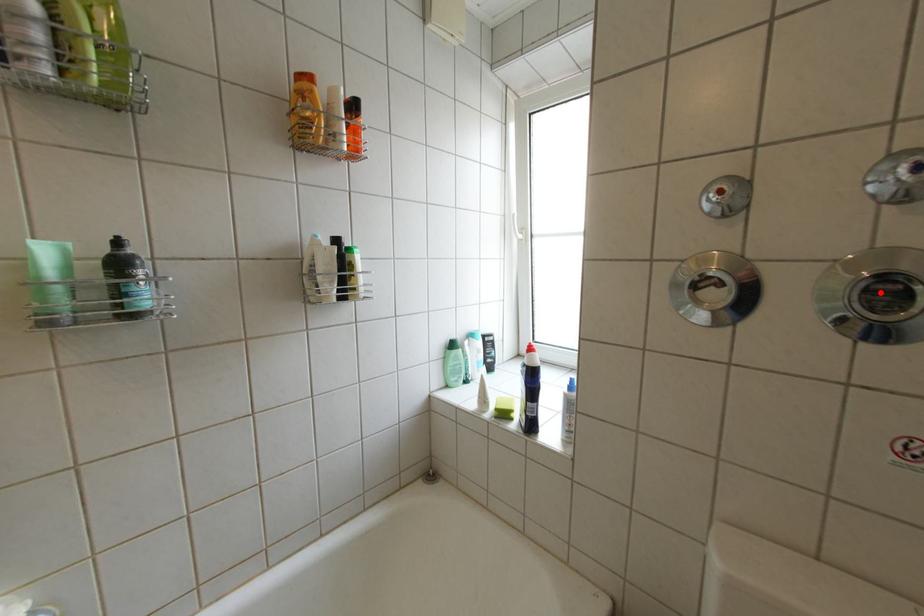
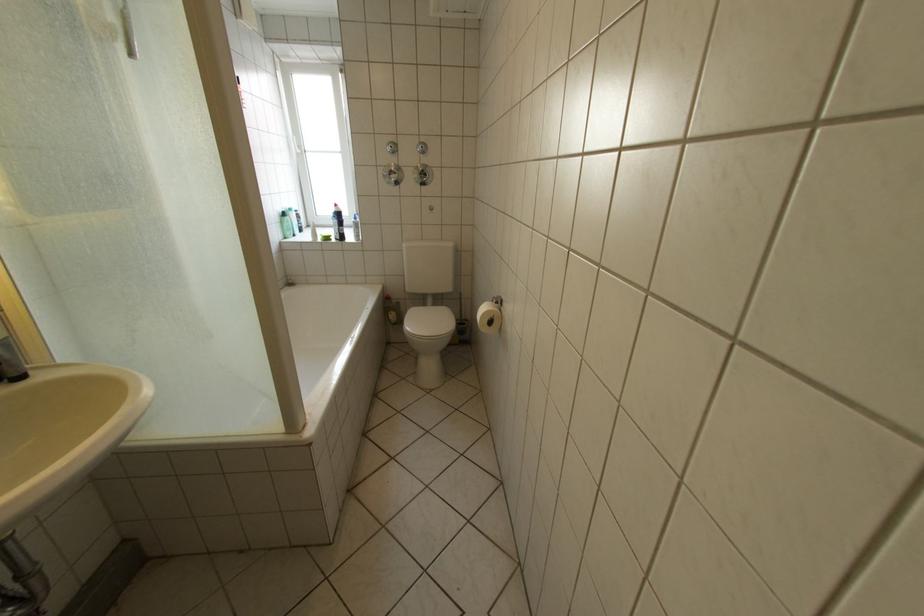
Question: I am providing you with two images of the same scene from different viewpoints. Image1 has a red point marked. In image2, the corresponding 3D location appears at what relative position? Reply with the corresponding letter.

Choices:
 (A) Closer
 (B) Farther

Answer: (A)